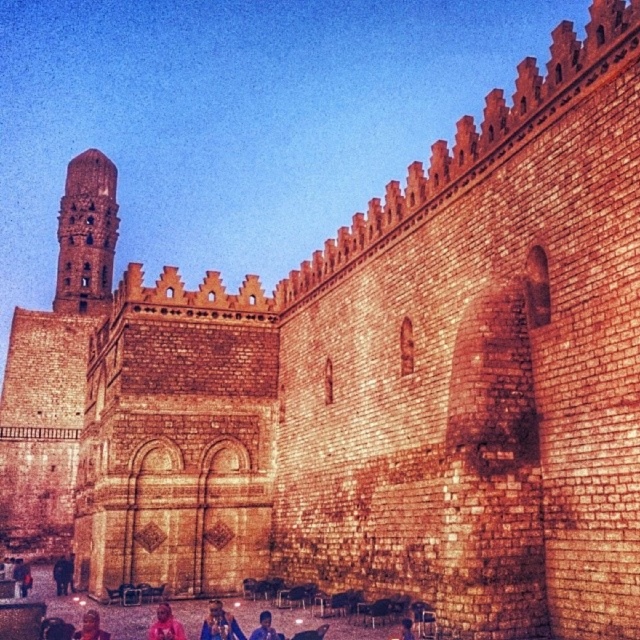
You are a tourist standing in front of the historic stone structure. You notice a blue fabric shirt at lower center. Where exactly is the blue fabric shirt located in the scene?

The blue fabric shirt at lower center is located at point coordinates of 0.983 on the x axis and 0.416 on the y axis.

You are a tour guide explaining the historic stone structure to visitors. You point to the blue denim jeans at lower center located at point (220, 624). What is the significance of the location where you are pointing?

The blue denim jeans at lower center located at point (220, 624) is positioned at the base of the historic stone structure, indicating where visitors commonly gather to admire the architecture and historical significance of the wall and its tower.